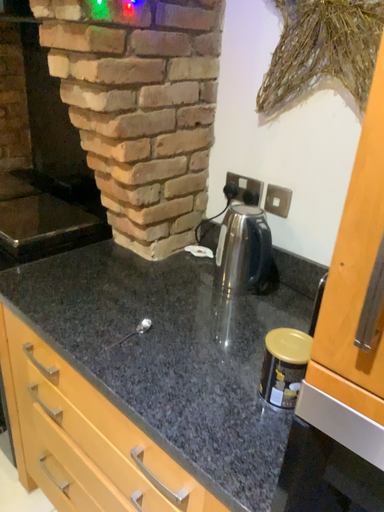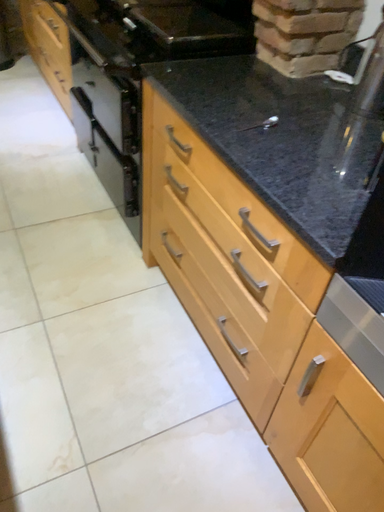
Question: Which way did the camera rotate in the video?

Choices:
 (A) rotated right
 (B) rotated left

Answer: (B)